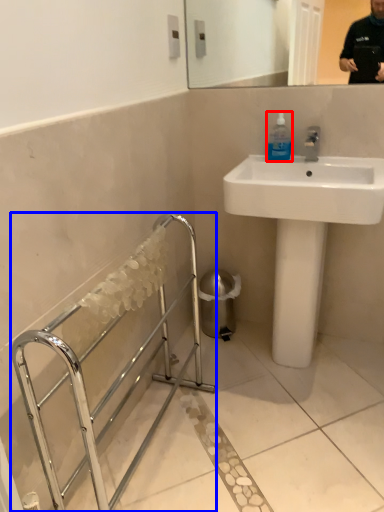
Question: Which of the following is the closest to the observer, mouthwash (highlighted by a red box) or balustrade (highlighted by a blue box)?

Choices:
 (A) mouthwash
 (B) balustrade

Answer: (B)